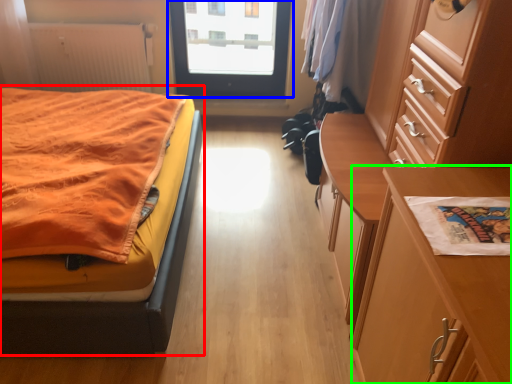
Question: Based on their relative distances, which object is farther from bed (highlighted by a red box)? Choose from door (highlighted by a blue box) and table (highlighted by a green box).

Choices:
 (A) door
 (B) table

Answer: (A)